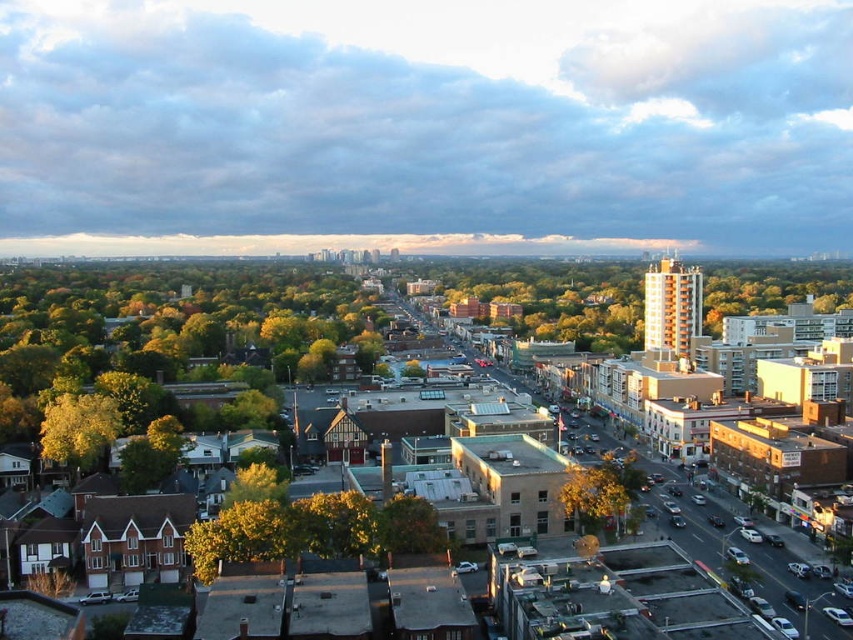
Question: Can you confirm if green leafy tree at lower left is positioned to the left of yellow-green leaves at left?

Choices:
 (A) no
 (B) yes

Answer: (B)

Question: Does orange brick building at center-right appear over yellow-green leaves at left?

Choices:
 (A) yes
 (B) no

Answer: (A)

Question: Which object is the closest to the yellow-green leaves at left?

Choices:
 (A) green leafy tree at lower left
 (B) orange brick building at center-right

Answer: (A)

Question: Which of these objects is positioned closest to the green matte tree at center?

Choices:
 (A) yellow-green leaves at center
 (B) green leafy tree at lower left

Answer: (A)

Question: Can you confirm if orange brick building at center-right is smaller than yellow-green leaves at center?

Choices:
 (A) yes
 (B) no

Answer: (B)

Question: Estimate the real-world distances between objects in this image. Which object is closer to the green matte tree at center?

Choices:
 (A) orange brick building at center-right
 (B) yellow-green leaves at left

Answer: (B)